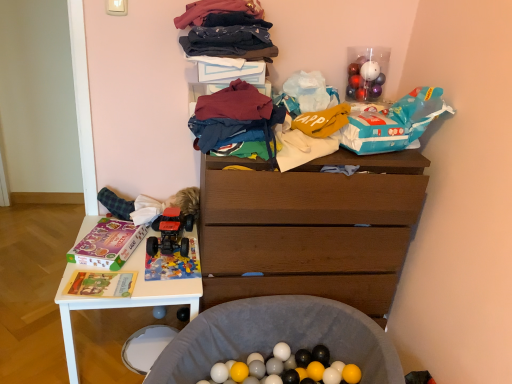
Question: From the image's perspective, would you say wooden chest of drawers at center is shown under matte purple magazine at left, the 2th magazine in the front-to-back sequence?

Choices:
 (A) no
 (B) yes

Answer: (B)

Question: Considering the relative sizes of wooden chest of drawers at center and matte purple magazine at left, which ranks as the first magazine in back-to-front order, in the image provided, is wooden chest of drawers at center shorter than matte purple magazine at left, which ranks as the first magazine in back-to-front order,?

Choices:
 (A) no
 (B) yes

Answer: (A)

Question: Does wooden chest of drawers at center come behind matte purple magazine at left, the 2th magazine in the front-to-back sequence?

Choices:
 (A) no
 (B) yes

Answer: (A)

Question: Considering the relative sizes of wooden chest of drawers at center and matte purple magazine at left, the second magazine when ordered from bottom to top, in the image provided, is wooden chest of drawers at center taller than matte purple magazine at left, the second magazine when ordered from bottom to top,?

Choices:
 (A) yes
 (B) no

Answer: (A)

Question: Considering the relative positions of wooden chest of drawers at center and matte purple magazine at left, arranged as the first magazine when viewed from the top, in the image provided, is wooden chest of drawers at center to the left of matte purple magazine at left, arranged as the first magazine when viewed from the top, from the viewer's perspective?

Choices:
 (A) yes
 (B) no

Answer: (B)

Question: Is wooden chest of drawers at center oriented away from matte purple magazine at left, which ranks as the first magazine in back-to-front order?

Choices:
 (A) yes
 (B) no

Answer: (B)

Question: Does wooden chest of drawers at center have a lesser width compared to dark blue cotton socks at upper center, marked as the second clothing in a bottom-to-top arrangement?

Choices:
 (A) yes
 (B) no

Answer: (B)

Question: From a real-world perspective, is wooden chest of drawers at center below dark blue cotton socks at upper center, positioned as the first clothing in top-to-bottom order?

Choices:
 (A) no
 (B) yes

Answer: (B)

Question: Does wooden chest of drawers at center lie in front of dark blue cotton socks at upper center, positioned as the first clothing in top-to-bottom order?

Choices:
 (A) yes
 (B) no

Answer: (B)

Question: Would you say wooden chest of drawers at center is a long distance from dark blue cotton socks at upper center, positioned as the first clothing in top-to-bottom order?

Choices:
 (A) yes
 (B) no

Answer: (B)

Question: Is wooden chest of drawers at center turned away from dark blue cotton socks at upper center, marked as the second clothing in a bottom-to-top arrangement?

Choices:
 (A) no
 (B) yes

Answer: (A)

Question: Does wooden chest of drawers at center have a greater width compared to dark blue cotton socks at upper center, marked as the second clothing in a bottom-to-top arrangement?

Choices:
 (A) no
 (B) yes

Answer: (B)

Question: Considering the relative sizes of soft gray fabric ball pit at lower center, the 2th waste positioned from the top, and dark blue cotton socks at upper center, marked as the second clothing in a bottom-to-top arrangement, in the image provided, is soft gray fabric ball pit at lower center, the 2th waste positioned from the top, thinner than dark blue cotton socks at upper center, marked as the second clothing in a bottom-to-top arrangement,?

Choices:
 (A) yes
 (B) no

Answer: (B)